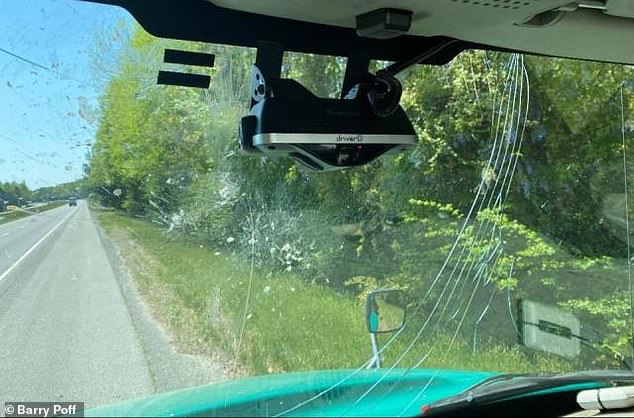
At what (x,y) coordinates should I click in order to perform the action: click on hood. Please return your answer as a coordinate pair (x, y). The width and height of the screenshot is (634, 418). Looking at the image, I should click on (262, 384).